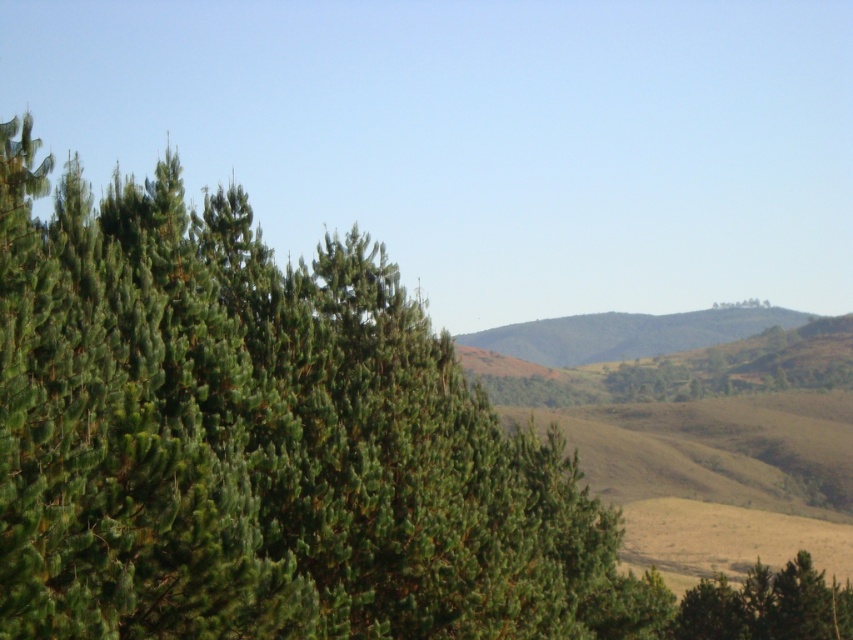
You are standing in the serene landscape and want to determine the relative positions of two points marked in the image. Which point, point (86,221) or point (845,625), is closer to your current viewpoint?

Point (86,221) is closer to the camera than point (845,625), so it is closer to your viewpoint.

You are standing in the serene landscape and notice a point marked at coordinates (x=262, y=442). What type of vegetation does this point indicate?

The point at coordinates (x=262, y=442) indicates green needle like vegetation.